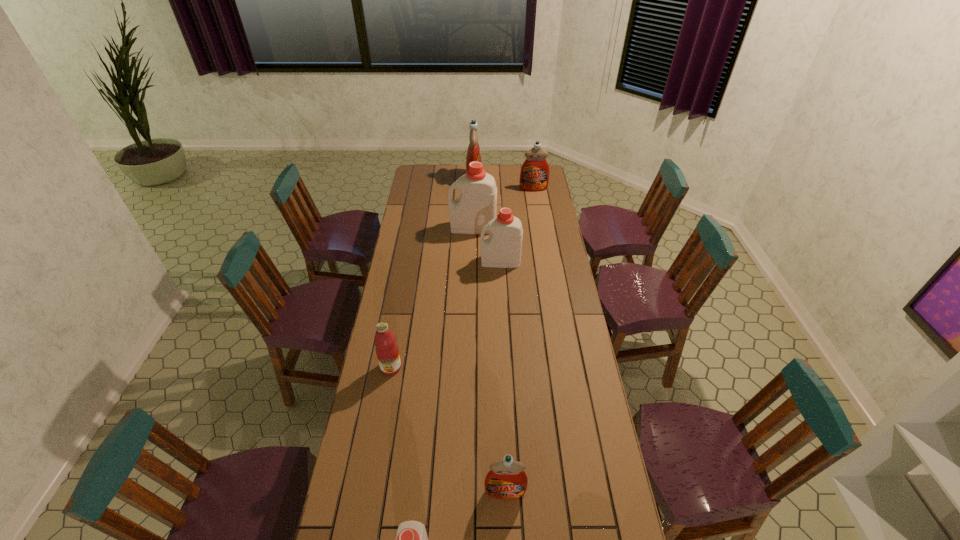
You are a GUI agent. You are given a task and a screenshot of the screen. Output one action in this format:
    pyautogui.click(x=<x>, y=<y>)
    Task: Click on the nearest red detergent
    The image size is (960, 540).
    Given the screenshot: What is the action you would take?
    pyautogui.click(x=506, y=480)

Where is `vacant area located 0.320m on the front surface of the biggest red detergent`? This screenshot has width=960, height=540. vacant area located 0.320m on the front surface of the biggest red detergent is located at coordinates (534, 179).

This screenshot has height=540, width=960. In order to click on vacant space situated on the handle side of the fifth nearest object in this screenshot , I will do `click(427, 227)`.

At what (x,y) coordinates should I click in order to perform the action: click on vacant position located on the handle side of the fifth nearest object. Please return your answer as a coordinate pair (x, y). Looking at the image, I should click on (429, 227).

Identify the location of free space located on the handle side of the fifth nearest object. tap(411, 227).

What are the coordinates of `free region located on the front surface of the rightmost object` in the screenshot? It's located at (538, 214).

Identify the location of free region located on the handle side of the second nearest white detergent. (411, 261).

Find the location of a particular element. The image size is (960, 540). vacant space located 0.080m on the handle side of the second nearest white detergent is located at coordinates (464, 261).

Find the location of `blank area located 0.390m on the handle side of the second nearest white detergent`. blank area located 0.390m on the handle side of the second nearest white detergent is located at coordinates (400, 261).

What are the coordinates of `vacant space situated 0.110m on the label of the leftmost object` in the screenshot? It's located at (385, 402).